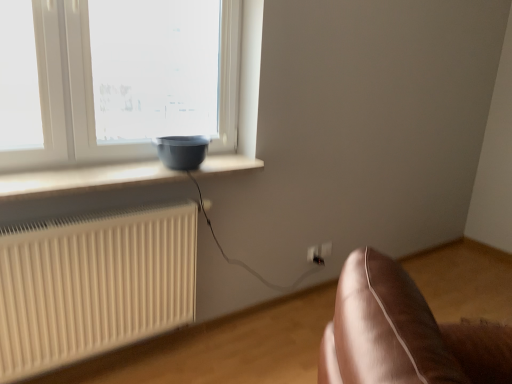
Question: Considering the relative positions of matte black bowl at left and matte gray bowl at window in the image provided, is matte black bowl at left to the left or to the right of matte gray bowl at window?

Choices:
 (A) left
 (B) right

Answer: (A)

Question: Considering the positions of matte black bowl at left and matte gray bowl at window in the image, is matte black bowl at left bigger or smaller than matte gray bowl at window?

Choices:
 (A) big
 (B) small

Answer: (A)

Question: Which is farther from the white plastic electric outlet at lower right, which is the 1th electric outlet in left-to-right order?

Choices:
 (A) white ribbed radiator at lower left
 (B) white plastic electric outlet at lower right, acting as the 2th electric outlet starting from the front
 (C) matte gray bowl at window
 (D) matte black bowl at left

Answer: (A)

Question: Estimate the real-world distances between objects in this image. Which object is closer to the white plastic electric outlet at lower right, acting as the 2th electric outlet starting from the front?

Choices:
 (A) white plastic electric outlet at lower right, marked as the second electric outlet in a back-to-front arrangement
 (B) matte gray bowl at window
 (C) matte black bowl at left
 (D) white ribbed radiator at lower left

Answer: (A)